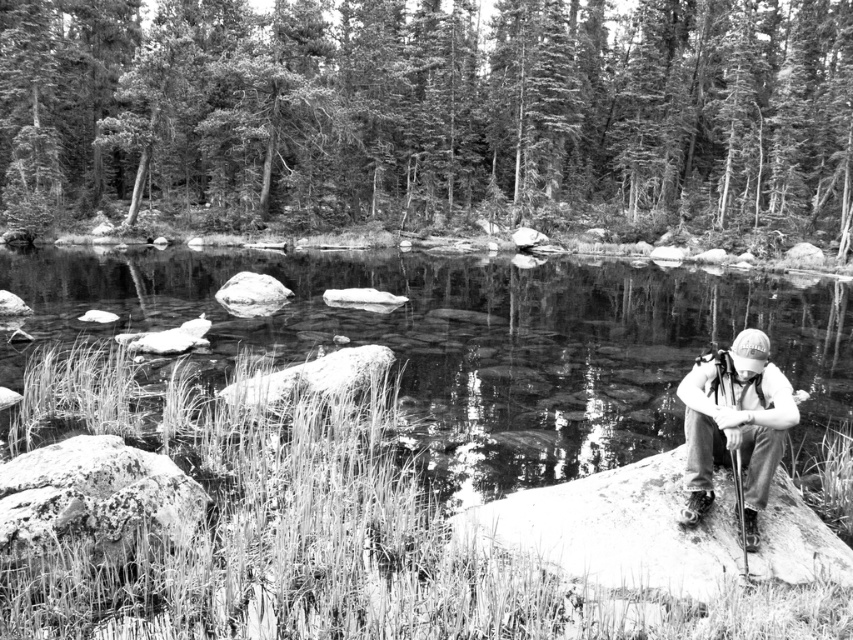
Question: Does smooth granite boulder at right appear on the left side of white fabric cap at right?

Choices:
 (A) yes
 (B) no

Answer: (A)

Question: Can you confirm if clear water at center is bigger than smooth granite boulder at right?

Choices:
 (A) no
 (B) yes

Answer: (B)

Question: Which point is farther to the camera?

Choices:
 (A) (569, 348)
 (B) (601, 563)

Answer: (A)

Question: Which object appears farthest from the camera in this image?

Choices:
 (A) white fabric cap at right
 (B) clear water at center

Answer: (B)

Question: Is clear water at center to the left of white fabric cap at right from the viewer's perspective?

Choices:
 (A) no
 (B) yes

Answer: (B)

Question: Among these points, which one is nearest to the camera?

Choices:
 (A) (628, 528)
 (B) (740, 412)

Answer: (B)